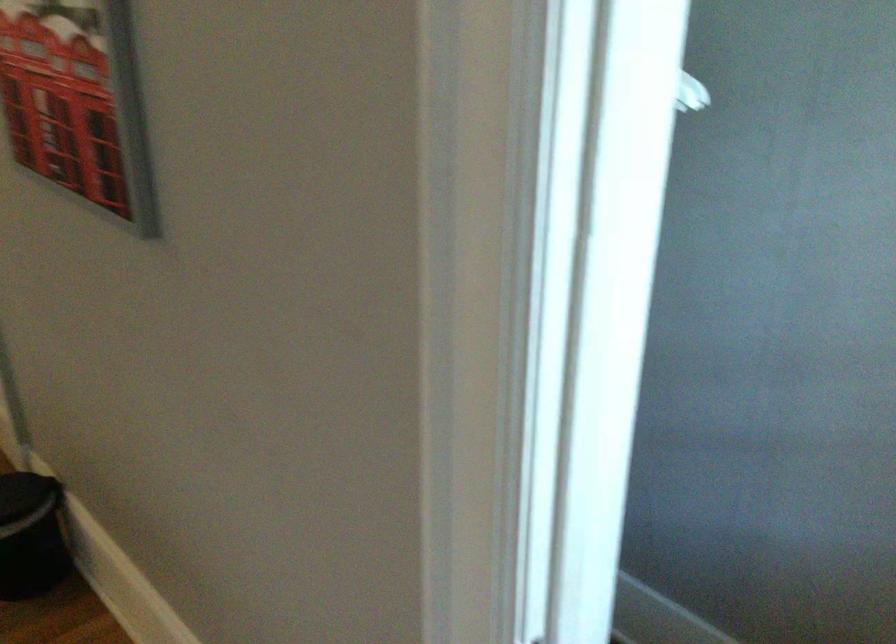
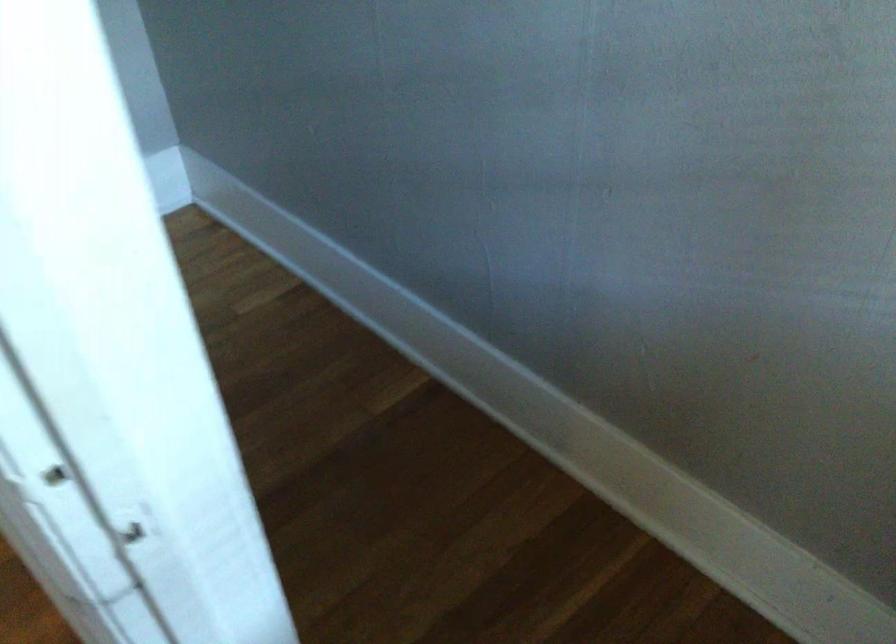
In the scene shown: The images are taken continuously from a first-person perspective. In which direction are you moving?

The movement direction of the cameraman is right, forward.